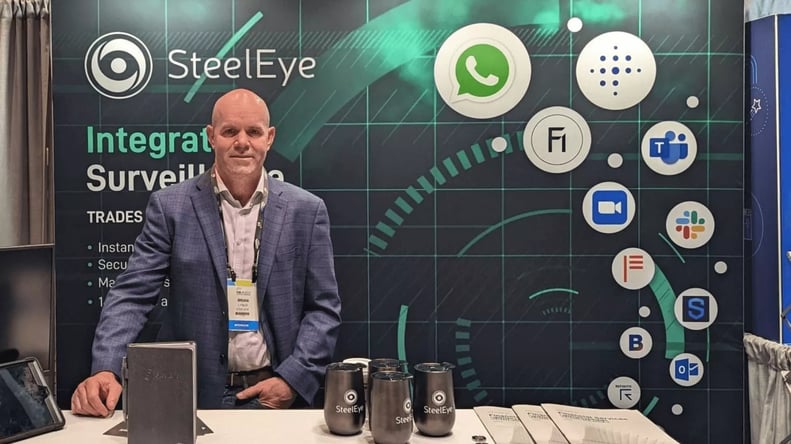
Find the location of `book standing up on table`. book standing up on table is located at coordinates (172, 381).